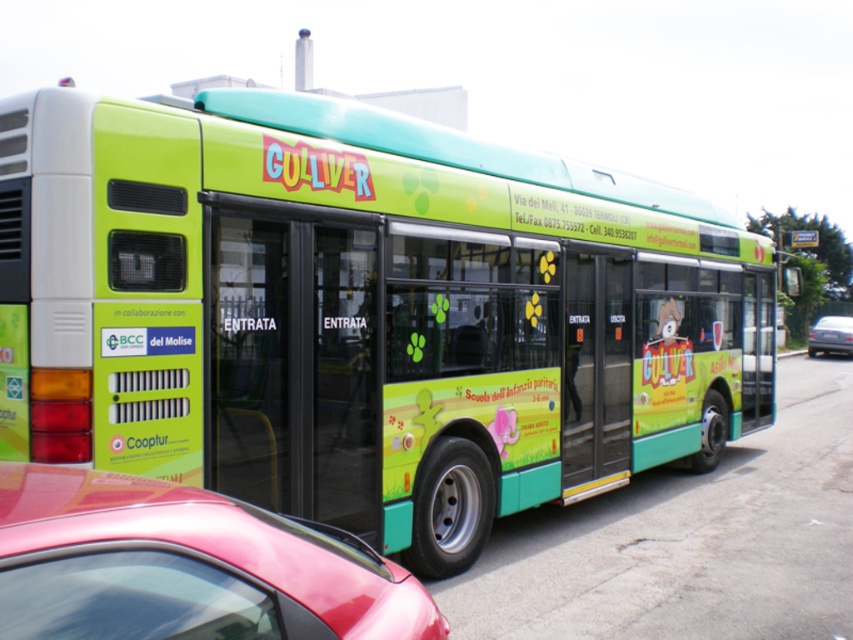
In the scene shown: Can you confirm if shiny red car at lower left is positioned above metallic silver sedan at center?

No.

Which is in front, point (428, 600) or point (814, 323)?

Point (428, 600)

The image size is (853, 640). What do you see at coordinates (184, 566) in the screenshot?
I see `shiny red car at lower left` at bounding box center [184, 566].

You are a GUI agent. You are given a task and a screenshot of the screen. Output one action in this format:
    pyautogui.click(x=<x>, y=<y>)
    Task: Click on the shiny red car at lower left
    This screenshot has width=853, height=640.
    Given the screenshot: What is the action you would take?
    184,566

Which is below, green matte bus at center or shiny red car at lower left?

Positioned lower is green matte bus at center.

Does point (376, 362) come farther from viewer compared to point (96, 580)?

Yes, it is.

The width and height of the screenshot is (853, 640). I want to click on green matte bus at center, so click(x=361, y=314).

Where is `green matte bus at center`? green matte bus at center is located at coordinates (361, 314).

Can you confirm if metallic silver sedan at center is thinner than black plastic license plate at center?

No, metallic silver sedan at center is not thinner than black plastic license plate at center.

Does metallic silver sedan at center have a greater height compared to black plastic license plate at center?

Indeed, metallic silver sedan at center has a greater height compared to black plastic license plate at center.

In order to click on metallic silver sedan at center in this screenshot , I will do `click(830, 336)`.

The height and width of the screenshot is (640, 853). In order to click on metallic silver sedan at center in this screenshot , I will do `click(830, 336)`.